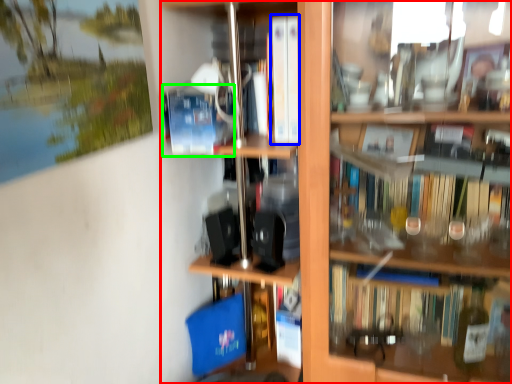
Question: Which object is positioned closest to shelf (highlighted by a red box)? Select from book (highlighted by a blue box) and paperback book (highlighted by a green box).

Choices:
 (A) book
 (B) paperback book

Answer: (A)